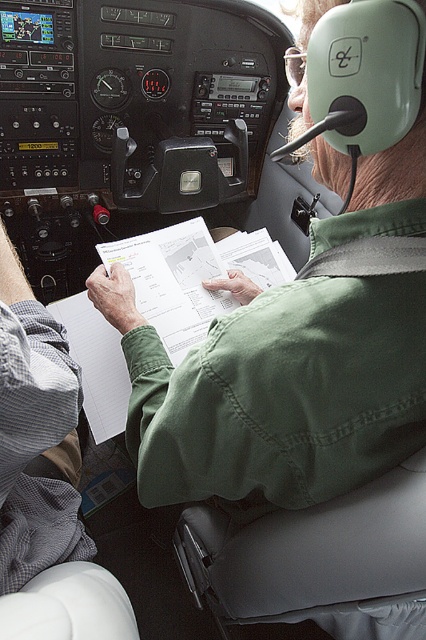
Question: Which point is farther to the camera?

Choices:
 (A) green cotton shirt at center
 (B) white paper at center

Answer: (B)

Question: Is green cotton shirt at center below white paper at center?

Choices:
 (A) yes
 (B) no

Answer: (A)

Question: Which point is closer to the camera?

Choices:
 (A) (172, 356)
 (B) (287, 346)

Answer: (B)

Question: Does green cotton shirt at center appear on the right side of white paper at center?

Choices:
 (A) no
 (B) yes

Answer: (B)

Question: Does green cotton shirt at center appear under white paper at center?

Choices:
 (A) yes
 (B) no

Answer: (A)